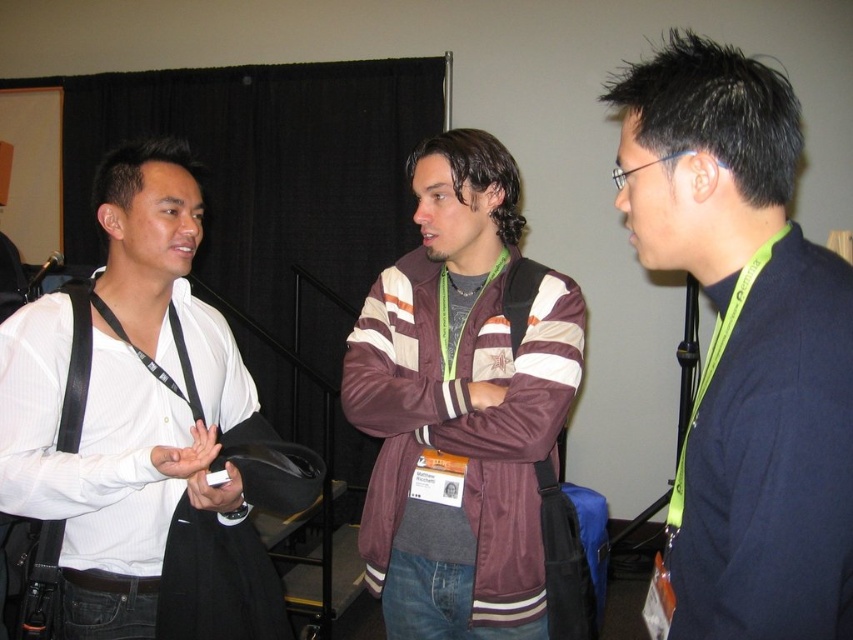
Where is `dark blue sweater at center`? dark blue sweater at center is located at coordinates (746, 346).

Does dark blue sweater at center have a lesser width compared to white shirt at left?

Yes, dark blue sweater at center is thinner than white shirt at left.

This screenshot has width=853, height=640. Find the location of `dark blue sweater at center`. dark blue sweater at center is located at coordinates (746, 346).

Which is below, maroon fabric jacket at center or white shirt at left?

maroon fabric jacket at center

Find the location of `maroon fabric jacket at center`. maroon fabric jacket at center is located at coordinates (462, 404).

Find the location of a particular element. This screenshot has height=640, width=853. maroon fabric jacket at center is located at coordinates (462, 404).

Does dark blue sweater at center have a lesser height compared to maroon fabric jacket at center?

Yes, dark blue sweater at center is shorter than maroon fabric jacket at center.

Between dark blue sweater at center and maroon fabric jacket at center, which one has less height?

Standing shorter between the two is dark blue sweater at center.

Identify the location of dark blue sweater at center. This screenshot has width=853, height=640. (746, 346).